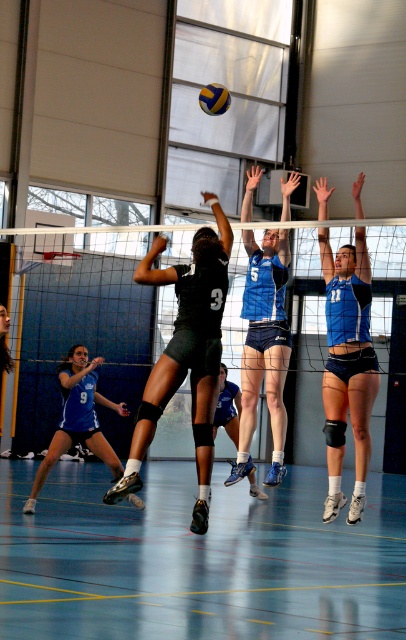
Question: Estimate the real-world distances between objects in this image. Which object is farther from the smooth wooden floor at center?

Choices:
 (A) black matte shorts at center
 (B) white mesh net at center
 (C) blue jersey at center

Answer: (B)

Question: Which point appears farthest from the camera in this image?

Choices:
 (A) (112, 627)
 (B) (274, 438)

Answer: (B)

Question: Which object is positioned closest to the yellow matte volleyball at center?

Choices:
 (A) blue jersey at lower left
 (B) blue jersey at center
 (C) smooth wooden floor at center

Answer: (A)

Question: Where is blue jersey at center located in relation to blue jersey at lower left in the image?

Choices:
 (A) below
 (B) above

Answer: (A)

Question: Observing the image, what is the correct spatial positioning of smooth wooden floor at center in reference to black matte shorts at center?

Choices:
 (A) above
 (B) below

Answer: (B)

Question: Can you confirm if smooth wooden floor at center is smaller than blue uniform at center?

Choices:
 (A) yes
 (B) no

Answer: (B)